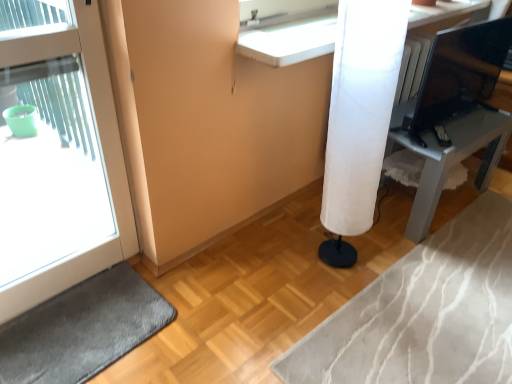
Question: Is white fabric lamp at right placed right next to white fabric lampshade at center-right?

Choices:
 (A) no
 (B) yes

Answer: (A)

Question: Would you consider white fabric lamp at right to be distant from white fabric lampshade at center-right?

Choices:
 (A) yes
 (B) no

Answer: (B)

Question: From the image's perspective, does white fabric lamp at right appear lower than white fabric lampshade at center-right?

Choices:
 (A) yes
 (B) no

Answer: (B)

Question: Is white fabric lamp at right positioned beyond the bounds of white fabric lampshade at center-right?

Choices:
 (A) yes
 (B) no

Answer: (A)

Question: Is white fabric lamp at right positioned in front of white fabric lampshade at center-right?

Choices:
 (A) yes
 (B) no

Answer: (B)

Question: Relative to white glossy door at left, is white fabric lampshade at center-right in front or behind?

Choices:
 (A) front
 (B) behind

Answer: (B)

Question: Looking at the image, does white fabric lampshade at center-right seem bigger or smaller compared to white glossy door at left?

Choices:
 (A) small
 (B) big

Answer: (A)

Question: From a real-world perspective, is white fabric lampshade at center-right positioned above or below white glossy door at left?

Choices:
 (A) below
 (B) above

Answer: (A)

Question: From the image's perspective, relative to white glossy door at left, is white fabric lampshade at center-right above or below?

Choices:
 (A) above
 (B) below

Answer: (A)

Question: From a real-world perspective, is dark gray carpet at lower left physically located above or below matte black monitor at upper right?

Choices:
 (A) above
 (B) below

Answer: (B)

Question: Visually, is dark gray carpet at lower left positioned to the left or to the right of matte black monitor at upper right?

Choices:
 (A) right
 (B) left

Answer: (B)

Question: From their relative heights in the image, would you say dark gray carpet at lower left is taller or shorter than matte black monitor at upper right?

Choices:
 (A) short
 (B) tall

Answer: (A)

Question: Is dark gray carpet at lower left wider or thinner than matte black monitor at upper right?

Choices:
 (A) wide
 (B) thin

Answer: (A)

Question: Is white fabric lamp at right in front of or behind matte black monitor at upper right in the image?

Choices:
 (A) behind
 (B) front

Answer: (A)

Question: From the image's perspective, is white fabric lamp at right located above or below matte black monitor at upper right?

Choices:
 (A) below
 (B) above

Answer: (A)